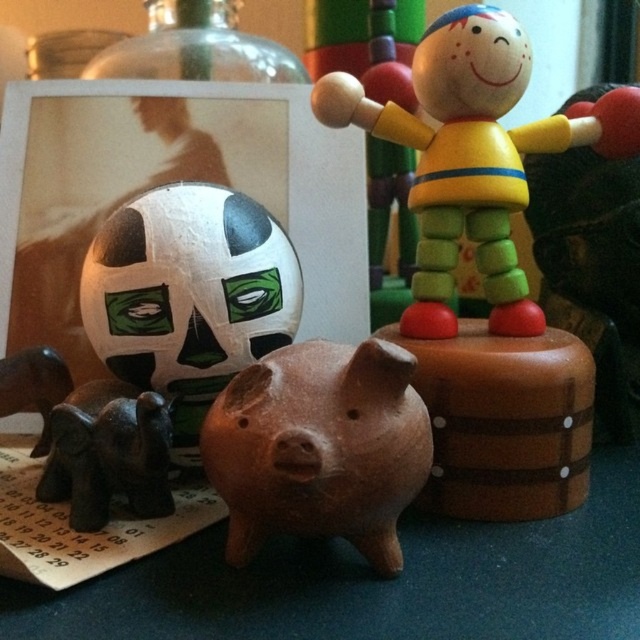
How distant is brown matte piggy bank at center from transparent glass bottle at upper left?

brown matte piggy bank at center and transparent glass bottle at upper left are 25.11 inches apart from each other.

What are the coordinates of `brown matte piggy bank at center` in the screenshot? It's located at (320, 448).

Is point (220, 432) positioned in front of point (241, 52)?

That is True.

I want to click on brown matte piggy bank at center, so click(x=320, y=448).

Does brown matte piggy bank at center have a larger size compared to dark brown wooden elephant at lower left?

Indeed, brown matte piggy bank at center has a larger size compared to dark brown wooden elephant at lower left.

Can you confirm if brown matte piggy bank at center is wider than dark brown wooden elephant at lower left?

Yes.

This screenshot has height=640, width=640. I want to click on brown matte piggy bank at center, so click(x=320, y=448).

Does dark brown wooden elephant at lower left appear under transparent glass bottle at upper left?

Indeed, dark brown wooden elephant at lower left is positioned under transparent glass bottle at upper left.

Find the location of a particular element. The height and width of the screenshot is (640, 640). dark brown wooden elephant at lower left is located at coordinates (108, 452).

Who is more forward, (52, 424) or (294, 58)?

Point (52, 424) is more forward.

Image resolution: width=640 pixels, height=640 pixels. In order to click on dark brown wooden elephant at lower left in this screenshot , I will do `click(108, 452)`.